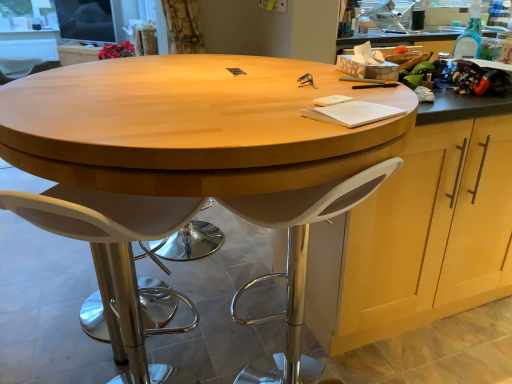
Question: From the image's perspective, is wooden cabinet at right, which is the second cabinetry from top to bottom, located above light wood cabinet at upper center, the 2th cabinetry in the front-to-back sequence?

Choices:
 (A) yes
 (B) no

Answer: (B)

Question: Is wooden cabinet at right, which is the second cabinetry from back to front, in front of light wood cabinet at upper center, marked as the 2th cabinetry in a right-to-left arrangement?

Choices:
 (A) yes
 (B) no

Answer: (A)

Question: Does wooden cabinet at right, arranged as the 1th cabinetry when viewed from the front, have a larger size compared to light wood cabinet at upper center, the second cabinetry from the bottom?

Choices:
 (A) yes
 (B) no

Answer: (A)

Question: Can you confirm if wooden cabinet at right, which is the first cabinetry from right to left, is taller than light wood cabinet at upper center, the 2th cabinetry in the front-to-back sequence?

Choices:
 (A) no
 (B) yes

Answer: (B)

Question: From a real-world perspective, is wooden cabinet at right, arranged as the 1th cabinetry when viewed from the front, on top of light wood cabinet at upper center, marked as the 2th cabinetry in a right-to-left arrangement?

Choices:
 (A) yes
 (B) no

Answer: (A)

Question: Does wooden cabinet at right, which is the first cabinetry from right to left, have a lesser width compared to light wood cabinet at upper center, placed as the 1th cabinetry when sorted from left to right?

Choices:
 (A) no
 (B) yes

Answer: (A)

Question: Is curtaintextured fabric at upper left outside wooden cabinet at right, which is the 1th cabinetry from bottom to top?

Choices:
 (A) no
 (B) yes

Answer: (B)

Question: Does curtaintextured fabric at upper left touch wooden cabinet at right, which is the 1th cabinetry from bottom to top?

Choices:
 (A) yes
 (B) no

Answer: (B)

Question: Is curtaintextured fabric at upper left further to camera compared to wooden cabinet at right, which is the first cabinetry from right to left?

Choices:
 (A) yes
 (B) no

Answer: (A)

Question: From the image's perspective, does curtaintextured fabric at upper left appear higher than wooden cabinet at right, which is the 2th cabinetry from left to right?

Choices:
 (A) yes
 (B) no

Answer: (A)

Question: Does curtaintextured fabric at upper left have a larger size compared to wooden cabinet at right, which is the 1th cabinetry from bottom to top?

Choices:
 (A) yes
 (B) no

Answer: (B)

Question: Is curtaintextured fabric at upper left at the left side of wooden cabinet at right, which is the second cabinetry from top to bottom?

Choices:
 (A) no
 (B) yes

Answer: (B)

Question: Considering the relative sizes of white plastic chair at left, the 2th chair positioned from the front, and white plastic stool at center in the image provided, is white plastic chair at left, the 2th chair positioned from the front, taller than white plastic stool at center?

Choices:
 (A) yes
 (B) no

Answer: (B)